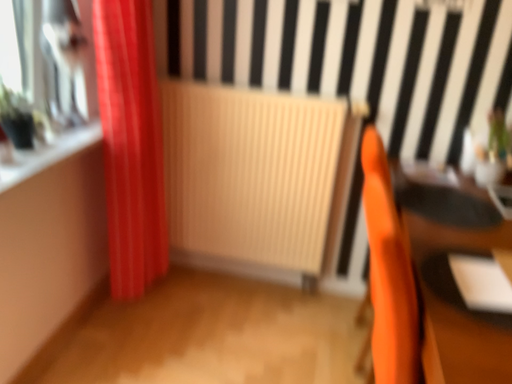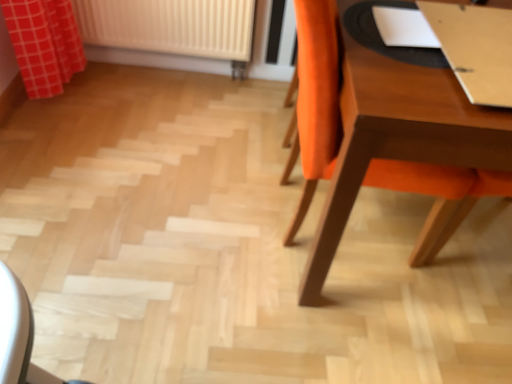
Question: How did the camera likely rotate when shooting the video?

Choices:
 (A) rotated downward
 (B) rotated upward

Answer: (A)